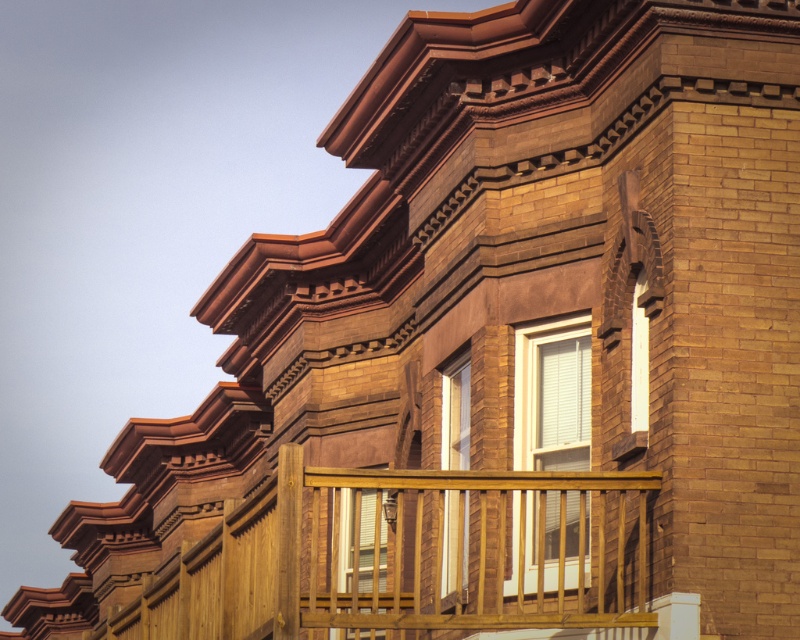
Can you confirm if matte white window at center is bigger than matte glass window at center?

Correct, matte white window at center is larger in size than matte glass window at center.

Is point (360, 557) positioned behind point (454, 522)?

Yes, it is.

Locate an element on the screen. This screenshot has width=800, height=640. matte white window at center is located at coordinates (364, 541).

Between white matte window at upper right and matte white window at center, which one has less height?

white matte window at upper right is shorter.

Does white matte window at upper right appear on the left side of matte white window at center?

Incorrect, white matte window at upper right is not on the left side of matte white window at center.

Which is in front, point (516, 582) or point (344, 634)?

Point (516, 582) is in front.

Where is `white matte window at upper right`? This screenshot has width=800, height=640. white matte window at upper right is located at coordinates click(x=552, y=394).

Between wooden at upper center and matte glass window at center, which one has more height?

Standing taller between the two is wooden at upper center.

Is wooden at upper center further to camera compared to matte glass window at center?

No, wooden at upper center is closer to the viewer.

Find the location of a particular element. wooden at upper center is located at coordinates (472, 548).